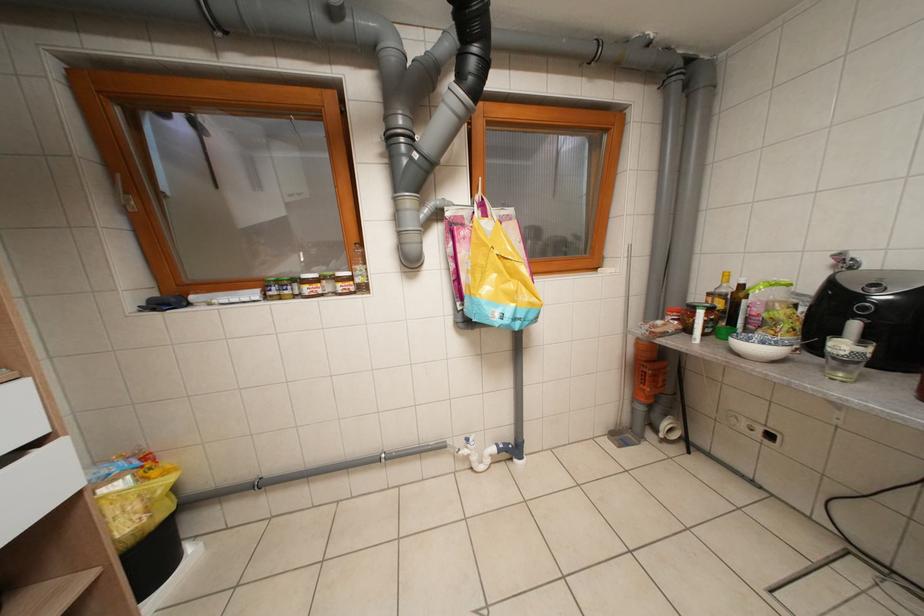
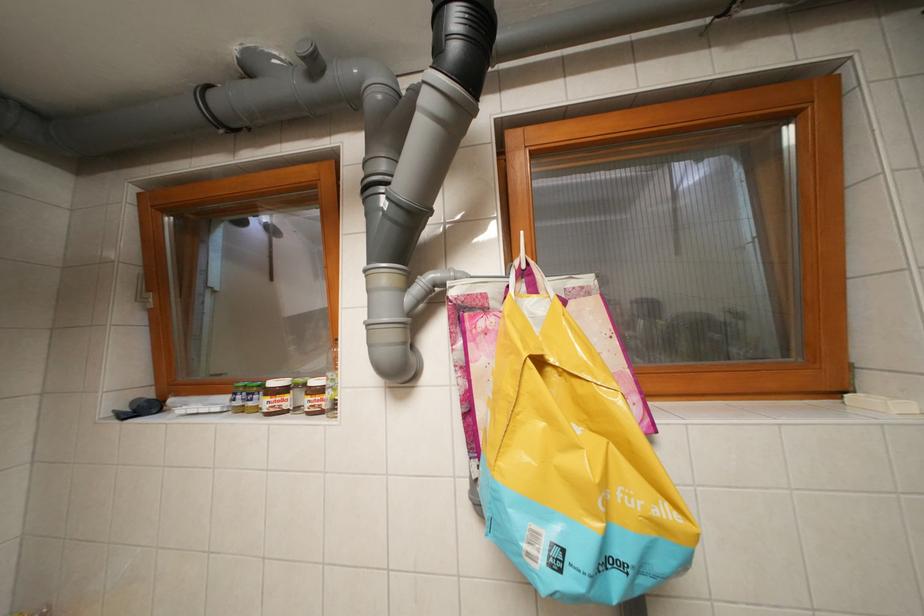
Question: Which direction would the cameraman need to move to produce the second image? Reply with the corresponding letter.

Choices:
 (A) Left
 (B) Right
 (C) Forward
 (D) Backward

Answer: (C)